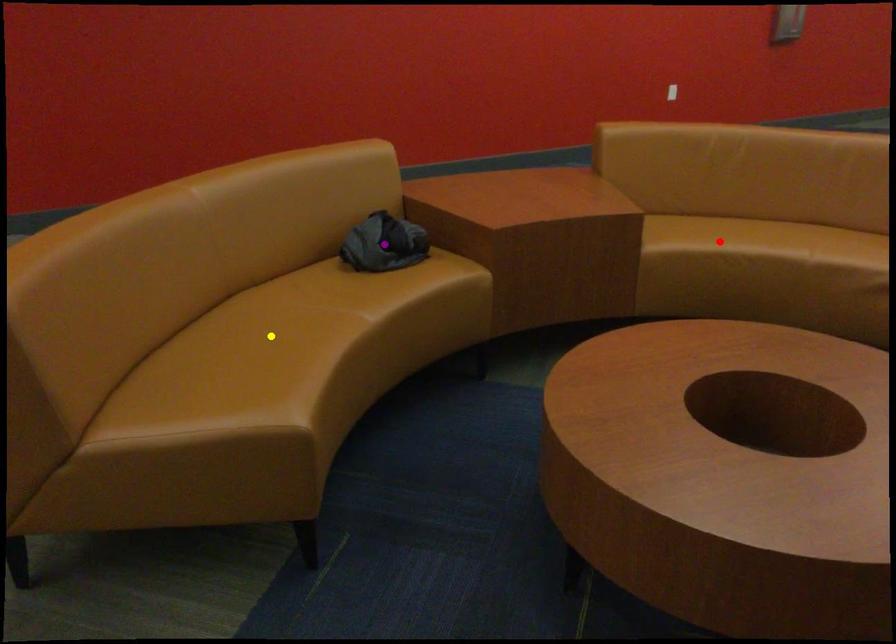
Order these from nearest to farthest:
purple point
red point
yellow point

yellow point
purple point
red point